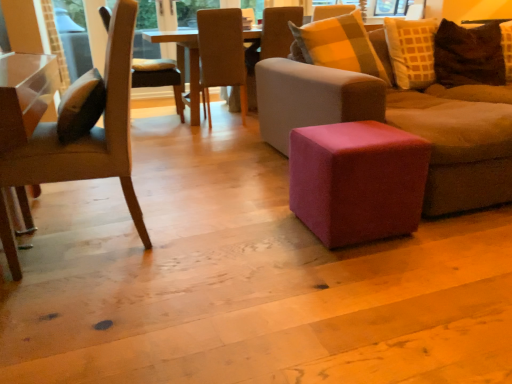
Question: Would you say matte brown chair at left, the first chair when ordered from front to back, is inside or outside pink fabric stool at center?

Choices:
 (A) outside
 (B) inside

Answer: (A)

Question: Considering their positions, is matte brown chair at left, which is counted as the 4th chair, starting from the back, located in front of or behind pink fabric stool at center?

Choices:
 (A) front
 (B) behind

Answer: (A)

Question: Which object is the closest to the wooden chair at center, the first chair when ordered from back to front?

Choices:
 (A) velvet brown couch at center
 (B) matte brown chair at left, which is counted as the 4th chair, starting from the back
 (C) light beige fabric chair at upper center, the 3th chair when ordered from front to back
 (D) beige fabric chair at center, acting as the 3th chair starting from the back
 (E) brown textured pillow at upper right

Answer: (D)

Question: Which object is the closest to the beige fabric chair at center, acting as the 3th chair starting from the back?

Choices:
 (A) wooden chair at center, which is the fourth chair from front to back
 (B) light beige fabric chair at upper center, positioned as the 2th chair in back-to-front order
 (C) matte brown chair at left, the first chair when ordered from front to back
 (D) brown textured pillow at upper right
 (E) velvet brown couch at center

Answer: (B)